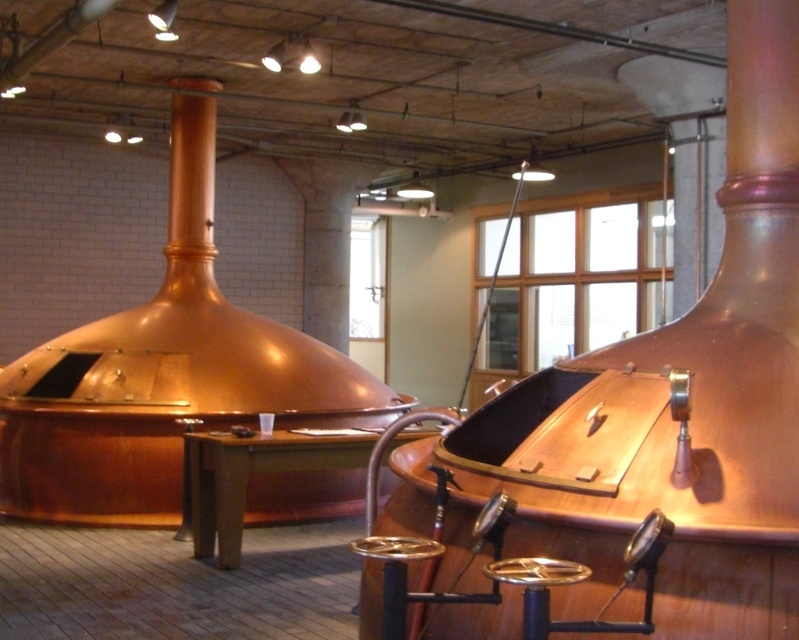
You are a brewer standing at the entrance of the brewery. You need to reach the metallic stool at center located at point (396, 573). What is the shortest path to reach it without crossing any of the large copper colored brewing kettles or stills?

The shortest path to reach the metallic stool at center at point (396, 573) would be to navigate around the large copper colored brewing kettles or stills that are positioned in the foreground, ensuring you do not cross them. Since the kettles are the main obstacles in the foreground, moving either to the left or right side of the kettles would provide the most direct route while avoiding them.